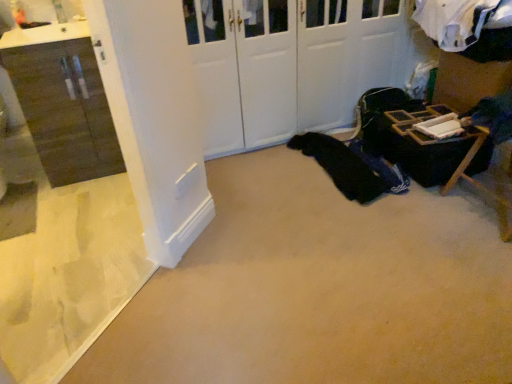
Question: Based on their positions, is white matte door at center located to the left or right of matte brown cabinet at left?

Choices:
 (A) right
 (B) left

Answer: (A)

Question: From a real-world perspective, relative to matte brown cabinet at left, is white matte door at center vertically above or below?

Choices:
 (A) above
 (B) below

Answer: (A)

Question: Which is nearer to the black fabric at center?

Choices:
 (A) matte brown cabinet at left
 (B) white matte door at center
 (C) wooden folding table at lower right

Answer: (C)

Question: Which object is positioned closest to the black fabric at center?

Choices:
 (A) wooden folding table at lower right
 (B) matte brown cabinet at left
 (C) white matte door at center

Answer: (A)